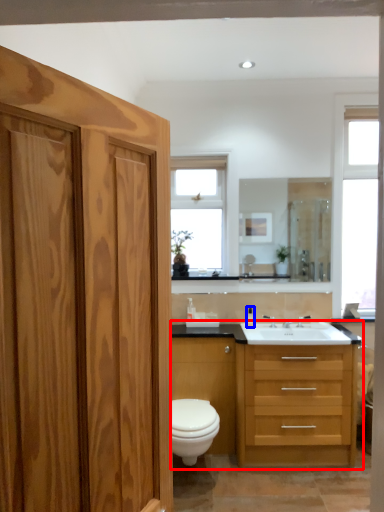
Question: Among these objects, which one is nearest to the camera, bathroom cabinet (highlighted by a red box) or toiletry (highlighted by a blue box)?

Choices:
 (A) bathroom cabinet
 (B) toiletry

Answer: (A)